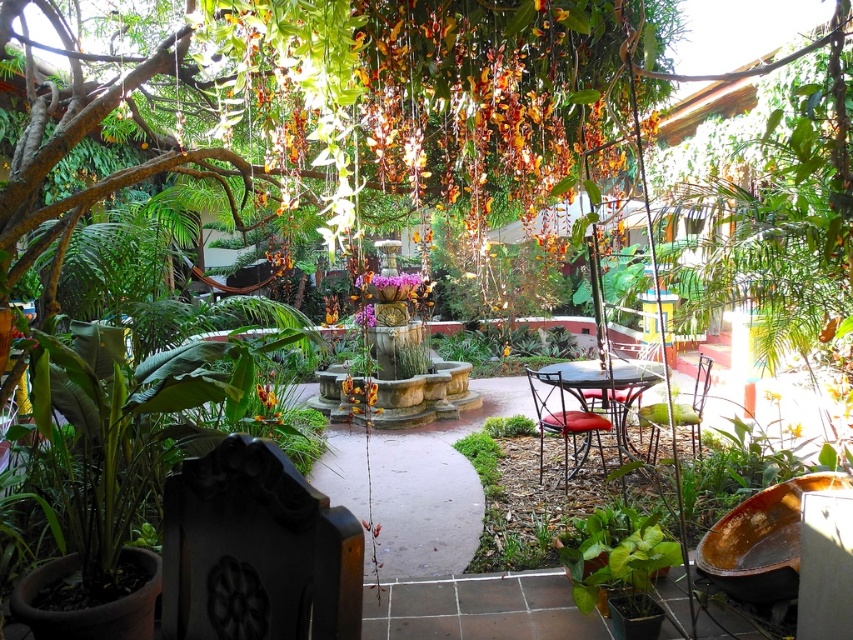
Question: Can you confirm if metallic brown table at center is positioned below metallic red chair at center?

Choices:
 (A) no
 (B) yes

Answer: (B)

Question: Can you confirm if metallic brown table at center is positioned above metallic red chair at center?

Choices:
 (A) yes
 (B) no

Answer: (B)

Question: Can you confirm if black stone chair at lower left is positioned above metallic red cushioned chair at center?

Choices:
 (A) no
 (B) yes

Answer: (B)

Question: Among these points, which one is farthest from the camera?

Choices:
 (A) pos(659,412)
 (B) pos(321,636)

Answer: (A)

Question: Which point is closer to the camera?

Choices:
 (A) metallic red chair at center
 (B) metallic green chair at center-right

Answer: (A)

Question: Which of these objects is positioned farthest from the metallic red cushioned chair at center?

Choices:
 (A) metallic brown table at center
 (B) green leafy plant at center

Answer: (B)